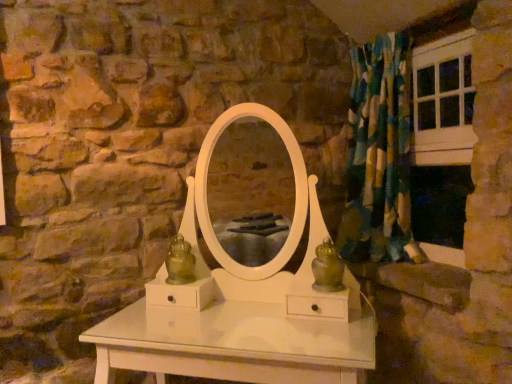
What do you see at coordinates (379, 155) in the screenshot? I see `multicolored fabric curtain at right` at bounding box center [379, 155].

The height and width of the screenshot is (384, 512). Find the location of `multicolored fabric curtain at right`. multicolored fabric curtain at right is located at coordinates (379, 155).

Measure the distance between point (356, 56) and camera.

Point (356, 56) is 7.44 feet away from camera.

Locate an element on the screen. The height and width of the screenshot is (384, 512). multicolored fabric curtain at right is located at coordinates (379, 155).